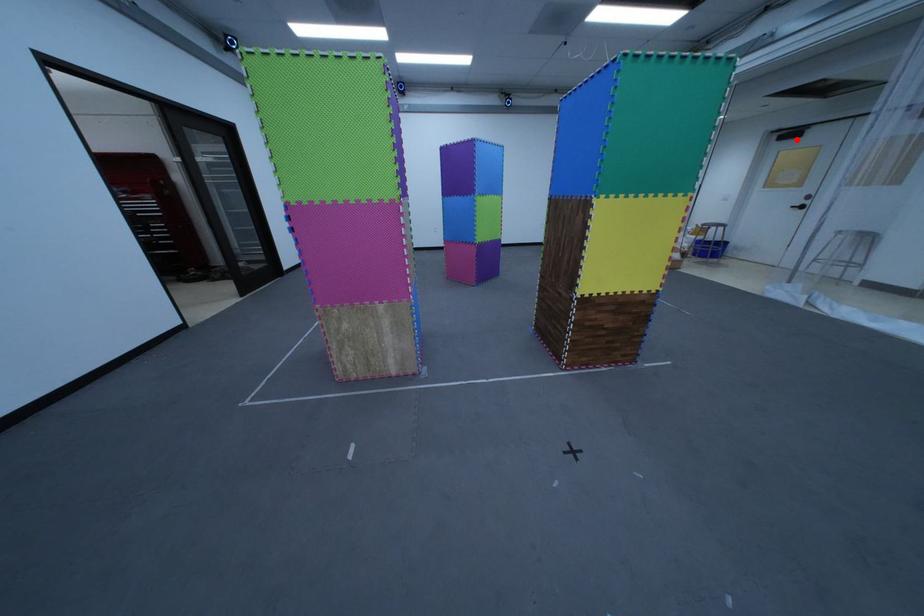
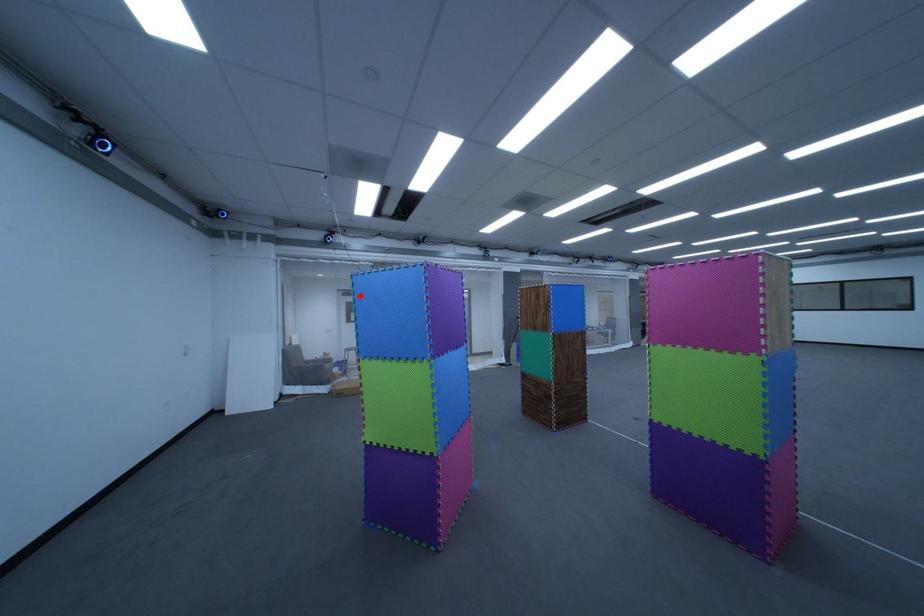
I am providing you with two images of the same scene from different viewpoints. A red point is marked on the first image and another point is marked on the second image. Is the red point in image1 aligned with the point shown in image2?

Yes